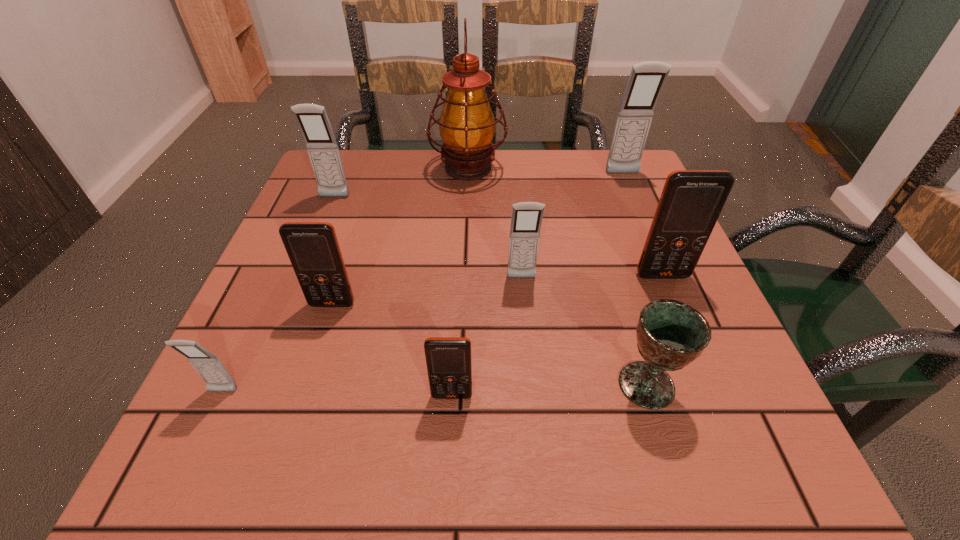
Identify the location of oil lamp. The width and height of the screenshot is (960, 540). (467, 125).

You are a GUI agent. You are given a task and a screenshot of the screen. Output one action in this format:
    pyautogui.click(x=<x>, y=<y>)
    Task: Click on the farthest cellular telephone
    
    Given the screenshot: What is the action you would take?
    pyautogui.click(x=647, y=79)

Find the location of a particular element. The width and height of the screenshot is (960, 540). the tallest cellular telephone is located at coordinates (647, 79).

In order to click on the third smallest gray cellular telephone in this screenshot , I will do click(x=312, y=119).

Locate an element on the screen. This screenshot has width=960, height=540. the sixth nearest cellular telephone is located at coordinates (312, 119).

Where is `the rightmost orange cellular telephone`? This screenshot has height=540, width=960. the rightmost orange cellular telephone is located at coordinates (691, 201).

I want to click on the farthest orange cellular telephone, so click(x=691, y=201).

This screenshot has height=540, width=960. What are the coordinates of `the third gray cellular telephone from left to right` in the screenshot? It's located at (526, 219).

Identify the location of the third biggest gray cellular telephone. (526, 219).

At what (x,y) coordinates should I click in order to perform the action: click on the third nearest cellular telephone. Please return your answer as a coordinate pair (x, y). The height and width of the screenshot is (540, 960). Looking at the image, I should click on (313, 249).